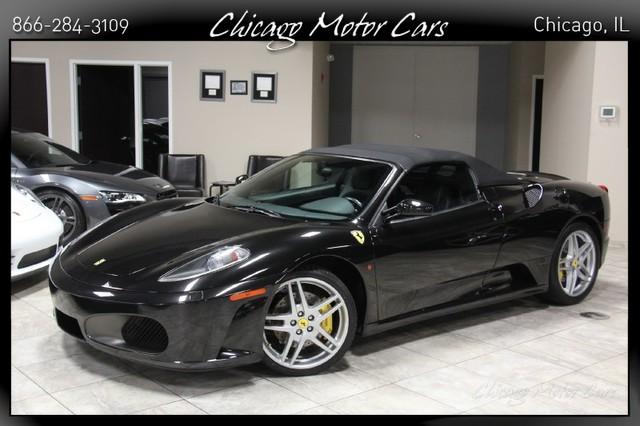
At what (x,y) coordinates should I click in order to perform the action: click on thermostat. Please return your answer as a coordinate pair (x, y). The image size is (640, 426). Looking at the image, I should click on (609, 112).